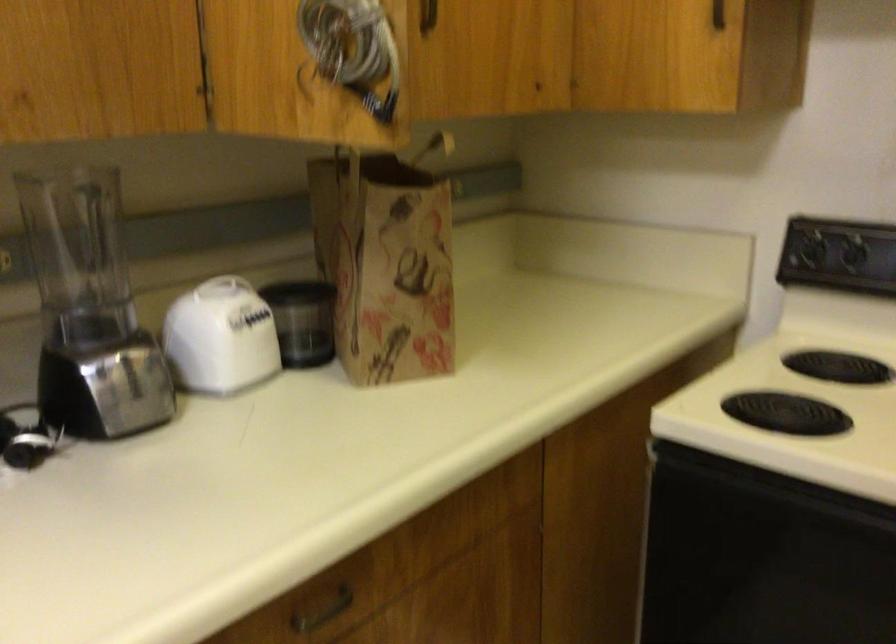
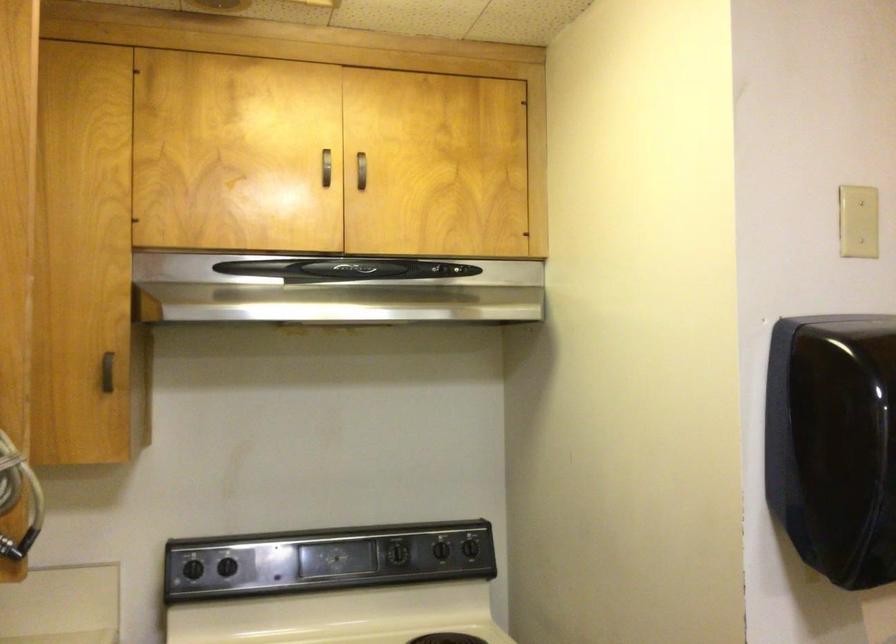
Where in the second image is the point corresponding to (x=812, y=243) from the first image?

(193, 569)